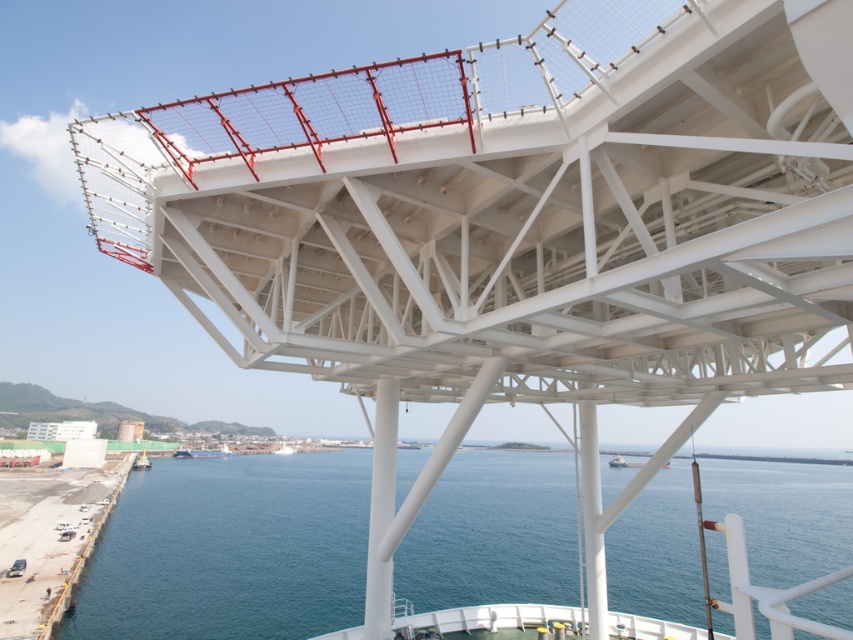
Looking at this image, can you confirm if blue water at center is positioned to the left of dark blue metal boat at lower left?

No, blue water at center is not to the left of dark blue metal boat at lower left.

Does blue water at center have a greater height compared to dark blue metal boat at lower left?

Correct, blue water at center is much taller as dark blue metal boat at lower left.

Locate an element on the screen. The width and height of the screenshot is (853, 640). blue water at center is located at coordinates (231, 548).

Where is `blue water at center`? blue water at center is located at coordinates (231, 548).

Who is shorter, blue water at center or white matte boat at center?

Standing shorter between the two is white matte boat at center.

You are a GUI agent. You are given a task and a screenshot of the screen. Output one action in this format:
    pyautogui.click(x=<x>, y=<y>)
    Task: Click on the blue water at center
    
    Given the screenshot: What is the action you would take?
    pyautogui.click(x=231, y=548)

Between concrete dock at lower left and dark blue metal boat at lower left, which one is positioned higher?

concrete dock at lower left is higher up.

Is point (48, 532) positioned in front of point (192, 454)?

Yes, point (48, 532) is in front of point (192, 454).

Does point (13, 632) come behind point (184, 451)?

No.

Identify the location of concrete dock at lower left. (49, 540).